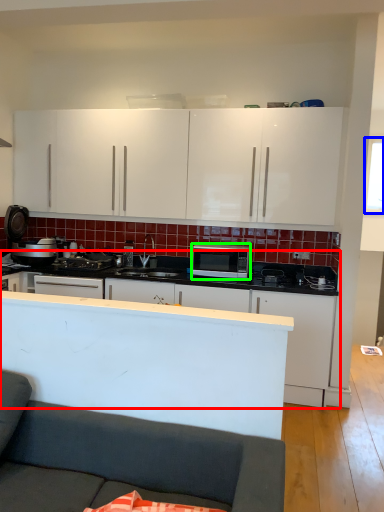
Question: Which is farther away from cabinetry (highlighted by a red box)? window screen (highlighted by a blue box) or microwave oven (highlighted by a green box)?

Choices:
 (A) window screen
 (B) microwave oven

Answer: (A)